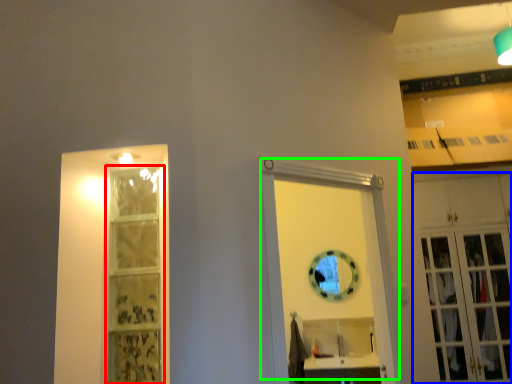
Question: Which object is the closest to the shelf (highlighted by a red box)? Choose among these: cabinetry (highlighted by a blue box) or door (highlighted by a green box).

Choices:
 (A) cabinetry
 (B) door

Answer: (B)